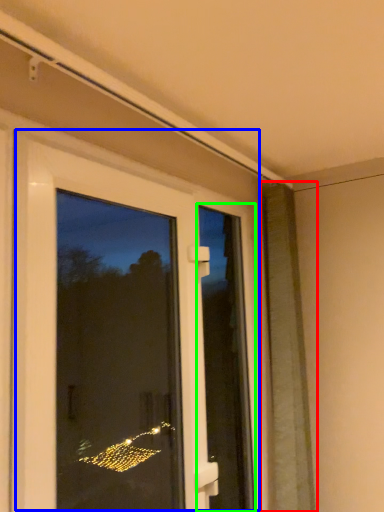
Question: Which is nearer to the shutter (highlighted by a red box)? door (highlighted by a blue box) or screen door (highlighted by a green box).

Choices:
 (A) door
 (B) screen door

Answer: (B)